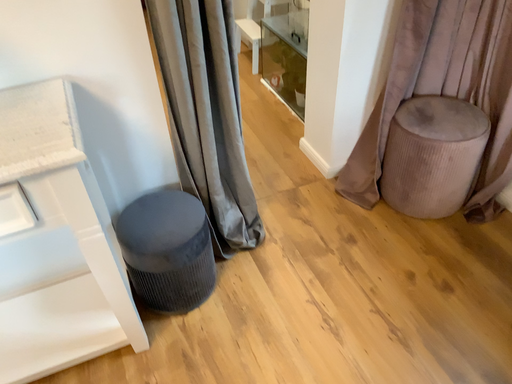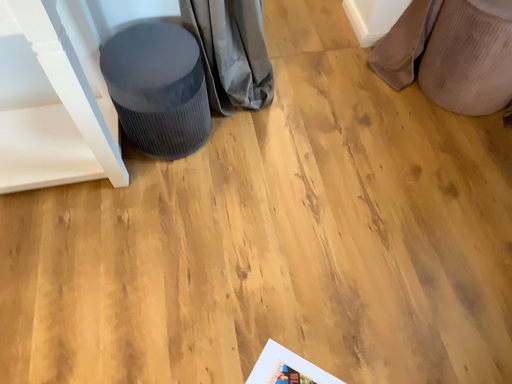
Question: How did the camera likely rotate when shooting the video?

Choices:
 (A) rotated upward
 (B) rotated downward

Answer: (B)